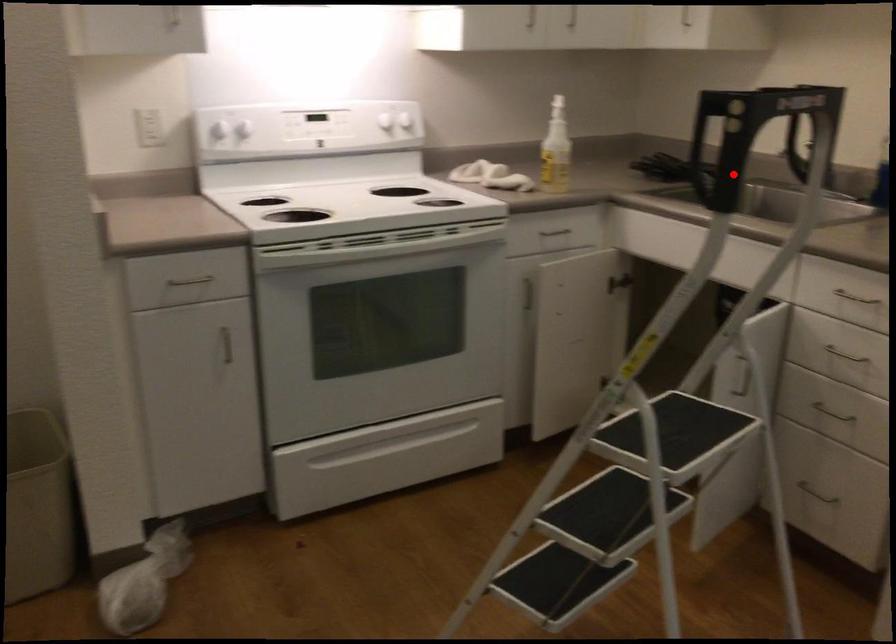
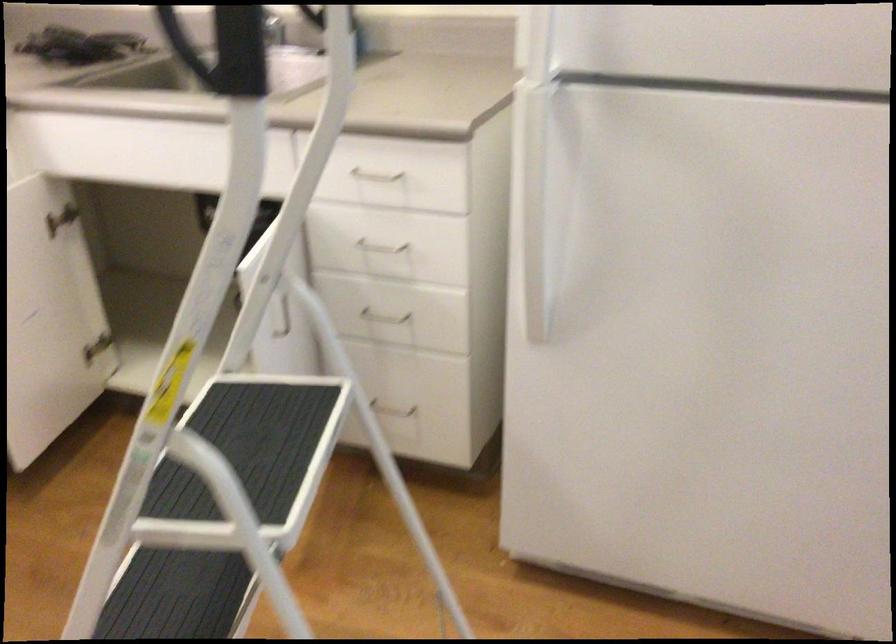
Question: I am providing you with two images of the same scene from different viewpoints. In image1, a red point is highlighted. Considering the same 3D point in image2, which of the following is correct?

Choices:
 (A) It is closer
 (B) It is farther

Answer: (A)